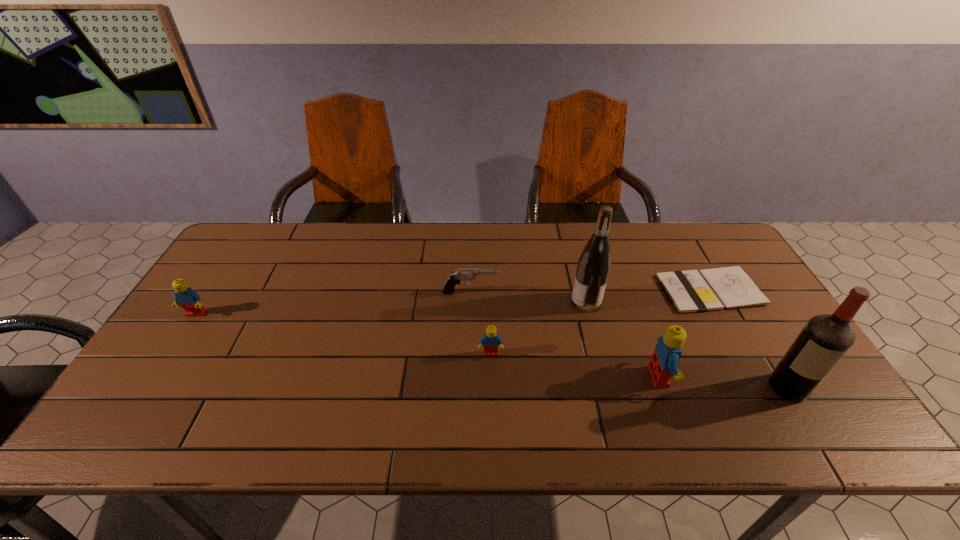
Identify the location of object located at the near right corner. The width and height of the screenshot is (960, 540). (825, 339).

The image size is (960, 540). Find the location of `vacant region at the far edge`. vacant region at the far edge is located at coordinates (651, 252).

Identify the location of free spot at the near edge of the desktop. (201, 401).

In the image, there is a desktop. At what (x,y) coordinates should I click in order to perform the action: click on vacant space at the left edge. Please return your answer as a coordinate pair (x, y). This screenshot has width=960, height=540. Looking at the image, I should click on (168, 360).

In the image, there is a desktop. Where is `vacant area at the far right corner`? vacant area at the far right corner is located at coordinates (706, 239).

This screenshot has width=960, height=540. In the image, there is a desktop. Find the location of `free space at the near right corner`. free space at the near right corner is located at coordinates (820, 392).

The image size is (960, 540). I want to click on vacant area that lies between the liquor and the fifth shortest object, so click(724, 382).

This screenshot has height=540, width=960. I want to click on unoccupied area between the third tallest object and the liquor, so click(724, 382).

Where is `vacant area that lies between the gun and the second Lego from right to left`? The height and width of the screenshot is (540, 960). vacant area that lies between the gun and the second Lego from right to left is located at coordinates (481, 323).

Locate an element on the screen. free space between the notepad and the second Lego from left to right is located at coordinates (600, 322).